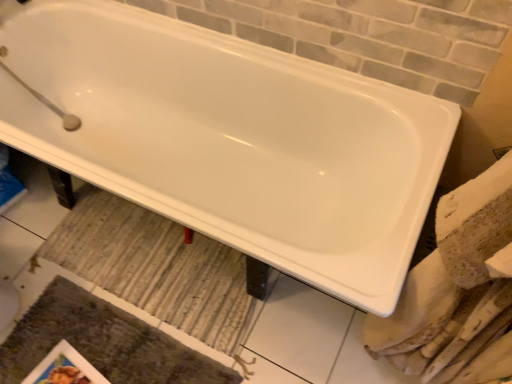
Where is `free spot behind matte paper magazine at lower left`? The height and width of the screenshot is (384, 512). free spot behind matte paper magazine at lower left is located at coordinates 80,325.